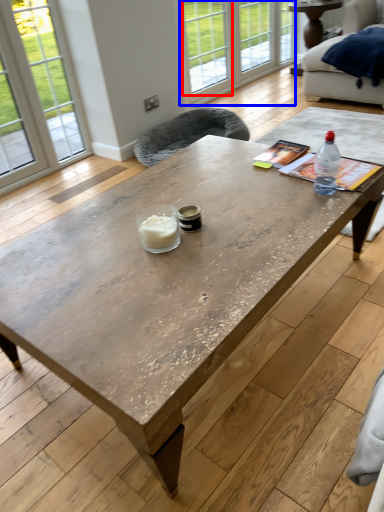
Question: Which point is further to the camera, window (highlighted by a red box) or glass door (highlighted by a blue box)?

Choices:
 (A) window
 (B) glass door

Answer: (B)